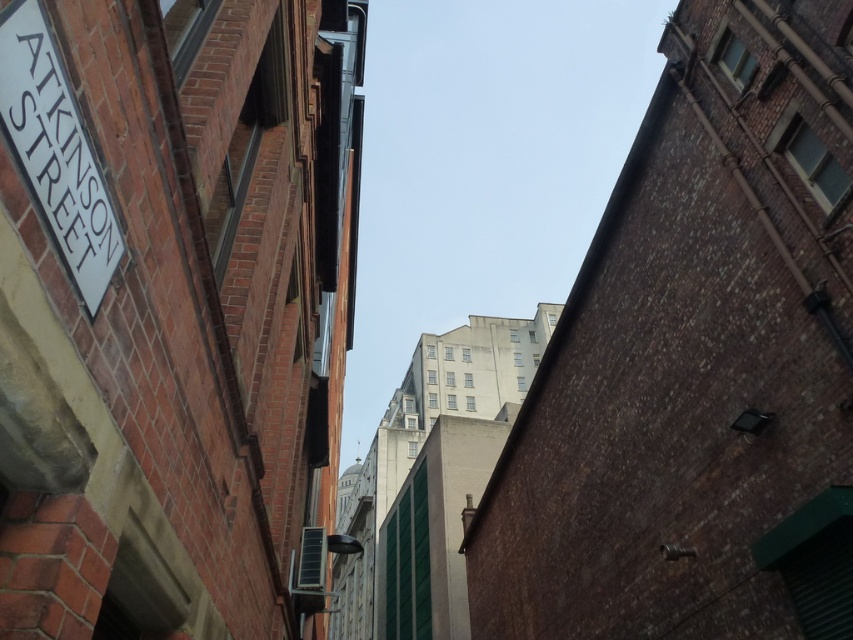
Can you confirm if brown brick wall at upper center is wider than white plastic street sign at upper left?

Yes, brown brick wall at upper center is wider than white plastic street sign at upper left.

Is brown brick wall at upper center thinner than white plastic street sign at upper left?

Incorrect, brown brick wall at upper center's width is not less than white plastic street sign at upper left's.

Does point (592, 481) come farther from viewer compared to point (24, 113)?

Yes, point (592, 481) is farther from viewer.

Identify the location of brown brick wall at upper center. The height and width of the screenshot is (640, 853). (697, 364).